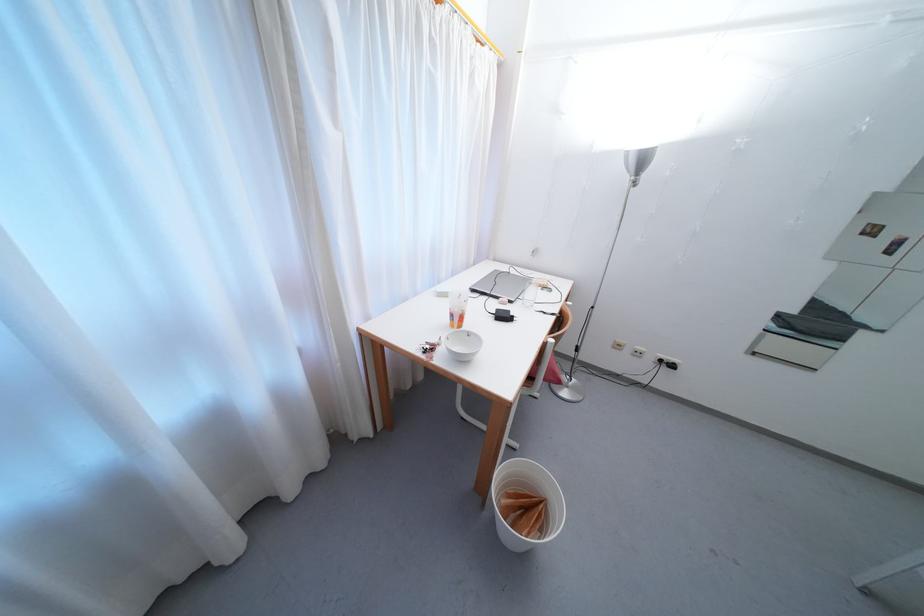
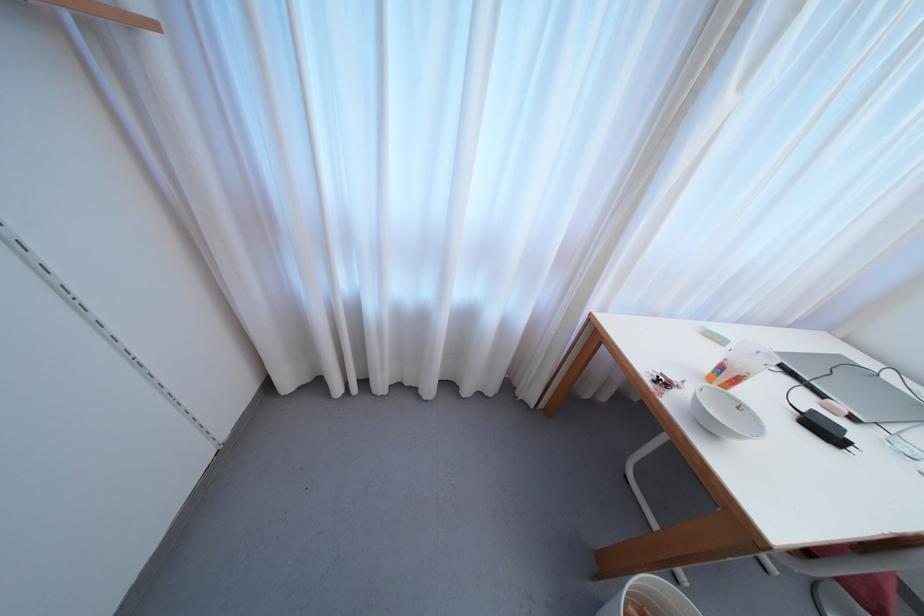
The point at (x=506, y=499) is marked in the first image. Where is the corresponding point in the second image?

(638, 607)